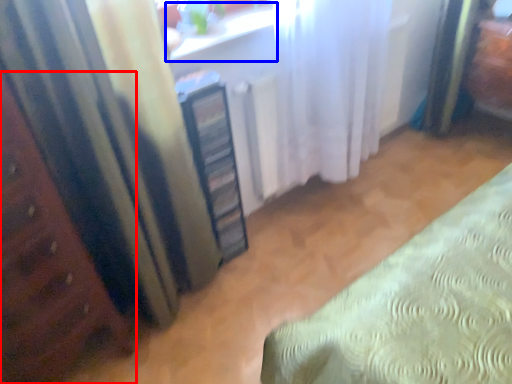
Question: Which of the following is the farthest to the observer, furniture (highlighted by a red box) or window sill (highlighted by a blue box)?

Choices:
 (A) furniture
 (B) window sill

Answer: (B)